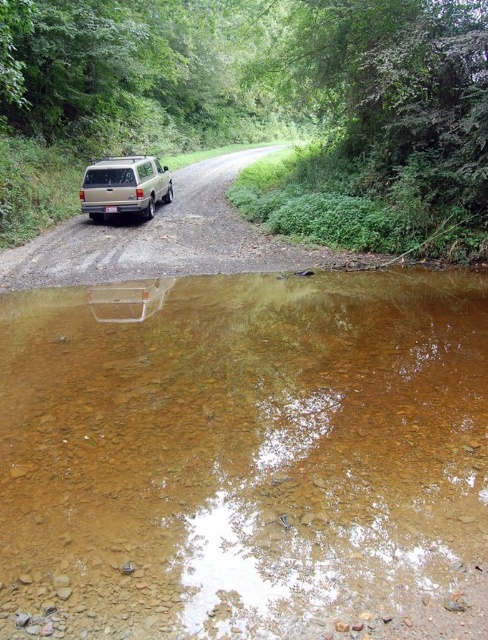
Question: Considering the relative positions of silver metallic suv at left and gold metallic minivan at center in the image provided, where is silver metallic suv at left located with respect to gold metallic minivan at center?

Choices:
 (A) below
 (B) above

Answer: (B)

Question: Is brown rocky stream at center below silver metallic suv at left?

Choices:
 (A) yes
 (B) no

Answer: (A)

Question: Among these points, which one is nearest to the camera?

Choices:
 (A) (166, 552)
 (B) (164, 195)

Answer: (A)

Question: Among these points, which one is nearest to the camera?

Choices:
 (A) (5, 310)
 (B) (89, 188)

Answer: (A)

Question: Can you confirm if silver metallic suv at left is positioned below gold metallic minivan at center?

Choices:
 (A) yes
 (B) no

Answer: (B)

Question: Which point is farther from the camera taking this photo?

Choices:
 (A) (341, 276)
 (B) (336, 22)
 (C) (90, 186)

Answer: (B)